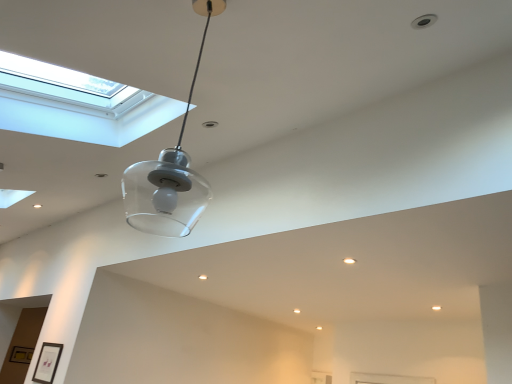
Question: Is matte black picture frame at lower left, arranged as the second picture frame when ordered from the bottom, to the left or to the right of gold metallic picture frame at lower left, which is the 2th picture frame in front-to-back order, in the image?

Choices:
 (A) right
 (B) left

Answer: (A)

Question: Is point (55, 352) positioned closer to the camera than point (24, 352)?

Choices:
 (A) farther
 (B) closer

Answer: (B)

Question: Which is farther from the matte black picture frame at lower left, which is the second picture frame in back-to-front order?

Choices:
 (A) transparent glass pendant light at center
 (B) gold metallic picture frame at lower left, which is counted as the first picture frame, starting from the left
 (C) transparent glass window at upper left

Answer: (C)

Question: Which is nearer to the gold metallic picture frame at lower left, which is counted as the first picture frame, starting from the left?

Choices:
 (A) transparent glass pendant light at center
 (B) transparent glass window at upper left
 (C) matte black picture frame at lower left, the first picture frame from the right

Answer: (C)